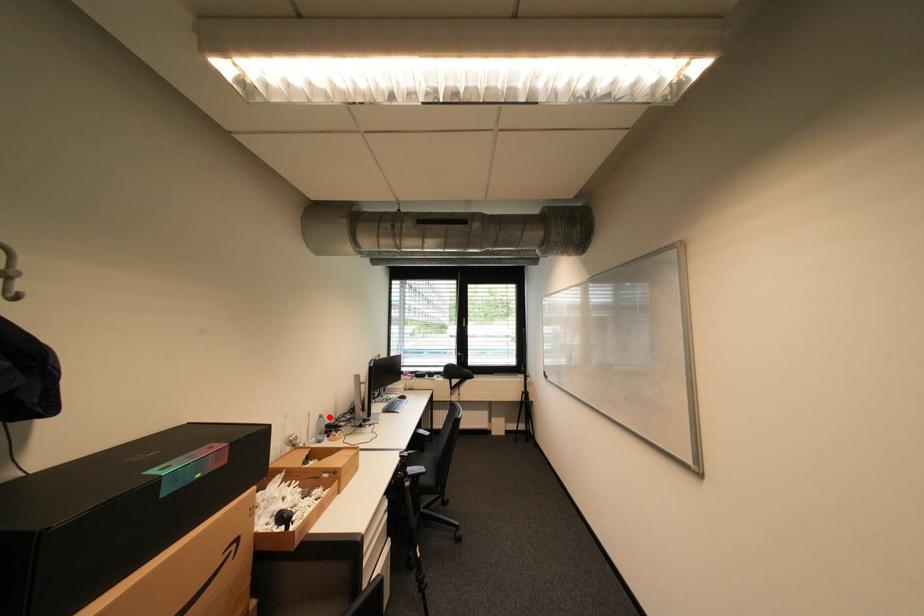
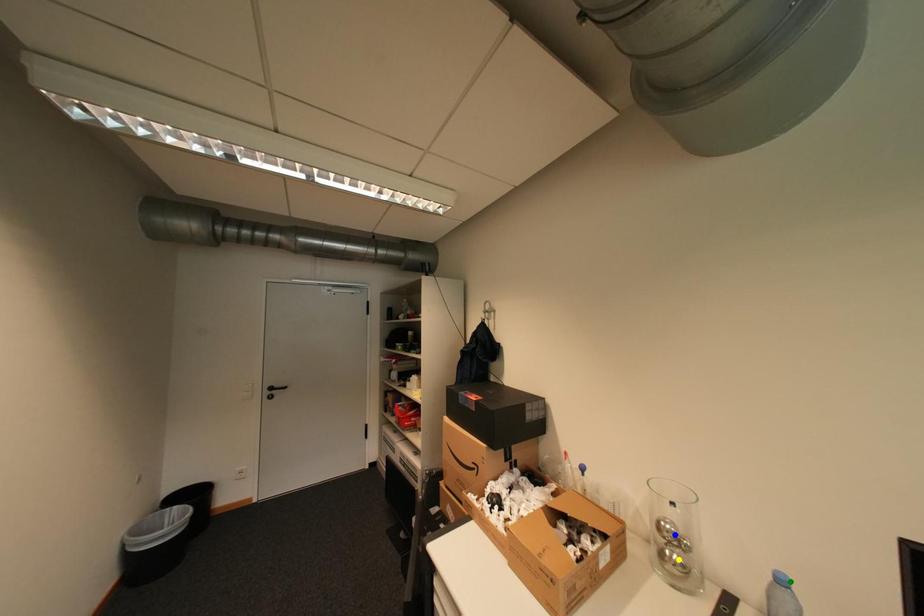
Question: I am providing you with two images of the same scene from different viewpoints. A red point is marked on the first image. You are given multiple points on the second image. Can you choose the point in image 2 that corresponds to the point in image 1?

Choices:
 (A) yellow point
 (B) blue point
 (C) green point

Answer: (C)